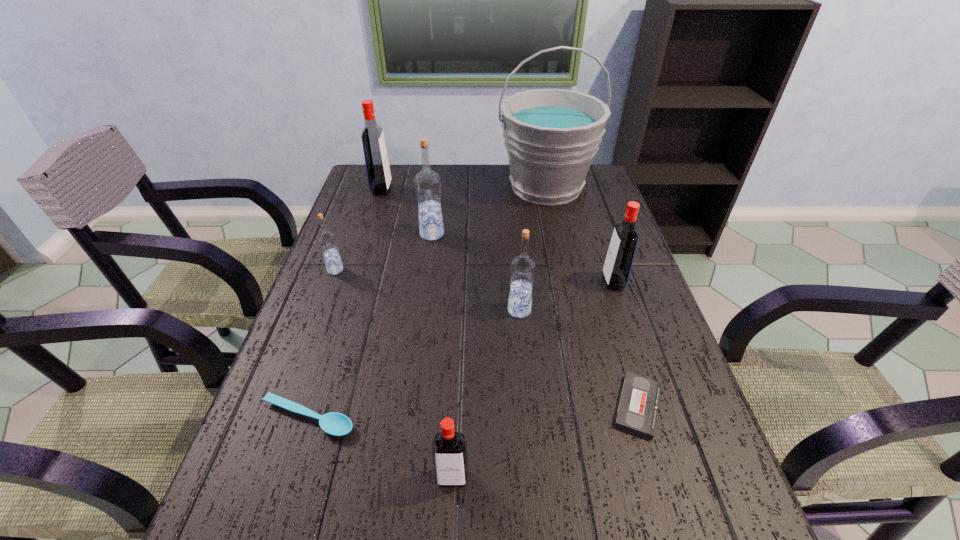
Locate an element on the screen. This screenshot has width=960, height=540. blue bucket is located at coordinates (551, 136).

The height and width of the screenshot is (540, 960). Find the location of `bucket`. bucket is located at coordinates (551, 136).

Locate an element on the screen. The image size is (960, 540). the fifth vodka from right to left is located at coordinates tap(376, 160).

Find the location of a particular element. The image size is (960, 540). the farthest vodka is located at coordinates (376, 160).

Find the location of a particular element. the second blue vodka from left to right is located at coordinates (427, 184).

This screenshot has width=960, height=540. What are the coordinates of `the fourth vodka from right to left` in the screenshot? It's located at (427, 184).

I want to click on the rightmost red vodka, so click(620, 255).

In order to click on the rightmost vodka in this screenshot , I will do [x=620, y=255].

Find the location of a particular element. This screenshot has height=540, width=960. the sixth farthest object is located at coordinates (522, 267).

What are the coordinates of `the second smallest blue vodka` in the screenshot? It's located at (522, 267).